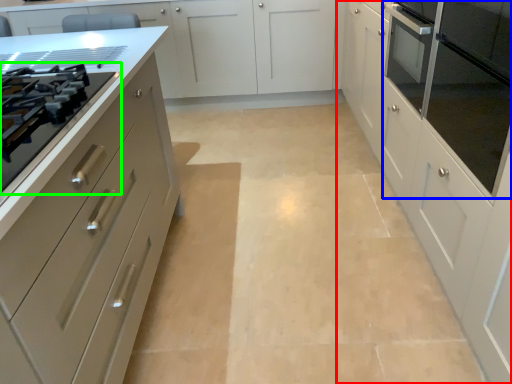
Question: Which object is positioned closest to cabinetry (highlighted by a red box)? Select from home appliance (highlighted by a blue box) and drawer (highlighted by a green box).

Choices:
 (A) home appliance
 (B) drawer

Answer: (A)